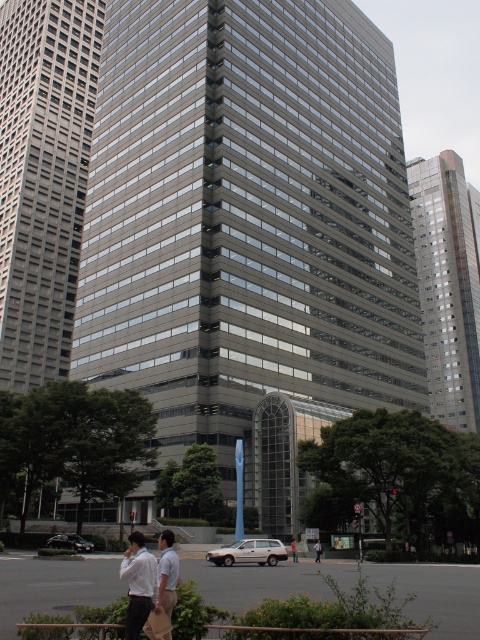
Between gray concrete building at center and white cotton shirt at center, which one is positioned higher?

Positioned higher is gray concrete building at center.

Does gray concrete building at center have a lesser width compared to white cotton shirt at center?

No, gray concrete building at center is not thinner than white cotton shirt at center.

Which is in front, point (39, 122) or point (294, 547)?

Positioned in front is point (294, 547).

This screenshot has width=480, height=640. What are the coordinates of `gray concrete building at center` in the screenshot? It's located at (43, 179).

Can you confirm if white shirt at center is wider than white cotton shirt at center?

Correct, the width of white shirt at center exceeds that of white cotton shirt at center.

Between white shirt at center and white cotton shirt at center, which one is positioned higher?

white shirt at center is higher up.

Who is more distant from viewer, (x=315, y=557) or (x=292, y=552)?

Positioned behind is point (x=315, y=557).

At what (x,y) coordinates should I click in order to perform the action: click on white shirt at center. Please return your answer as a coordinate pair (x, y). This screenshot has height=640, width=480. Looking at the image, I should click on (317, 550).

Is white shirt at lower center wider than white shirt at center?

Indeed, white shirt at lower center has a greater width compared to white shirt at center.

Can you confirm if white shirt at lower center is bigger than white shirt at center?

Correct, white shirt at lower center is larger in size than white shirt at center.

The height and width of the screenshot is (640, 480). I want to click on white shirt at lower center, so click(x=147, y=579).